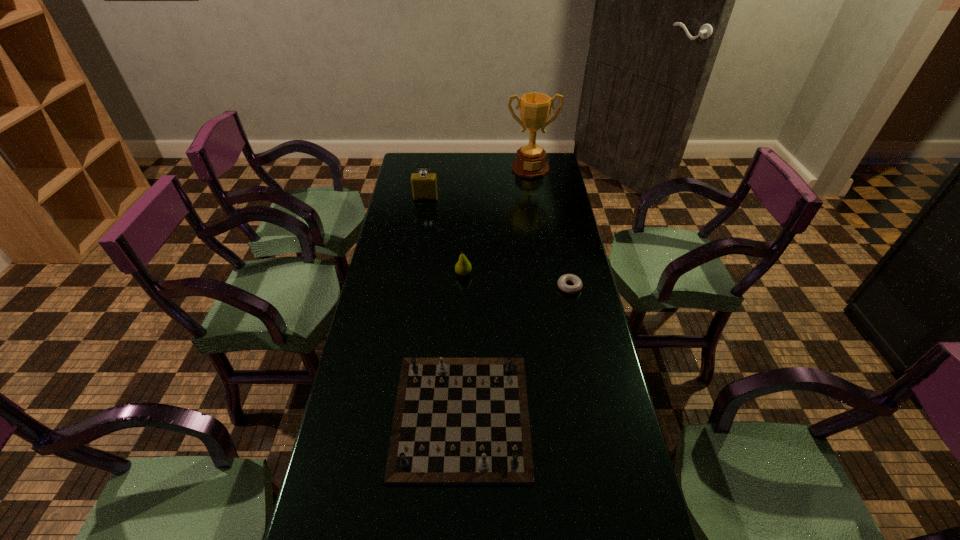
This screenshot has height=540, width=960. Identify the location of free spot that satisfies the following two spatial constraints: 1. on the front-facing side of the fourth nearest object; 2. on the right side of the pear. (414, 274).